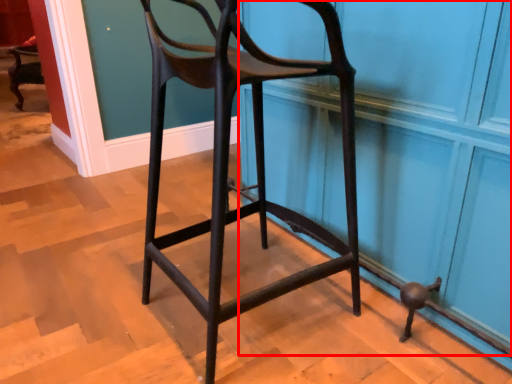
Question: Observing the image, what is the correct spatial positioning of screen door (annotated by the red box) in reference to chair?

Choices:
 (A) left
 (B) right

Answer: (B)